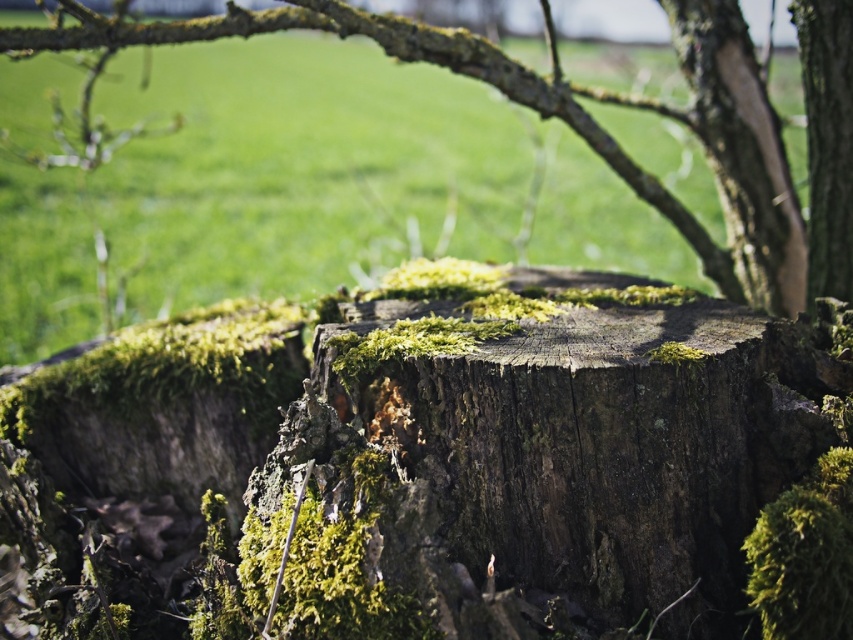
You are standing in front of the tree stump and want to place a small pebble on the point that is closer to you. Which point should you choose between point (838, 28) and point (836, 42)?

Point (838, 28) is in front of point (836, 42), so you should choose point (838, 28) because it is closer to you.

You are standing in a natural setting and see the green mossy wood at center and the smooth bark tree trunk at right. Which object is nearer to you?

The green mossy wood at center is closer to the viewer than the smooth bark tree trunk at right.

You are an observer standing in front of the tree stump. You notice two tree trunks in the scene. Which one is taller between the smooth bark tree trunk at upper right and the smooth bark tree trunk at right?

The smooth bark tree trunk at upper right is taller than the smooth bark tree trunk at right according to the description.